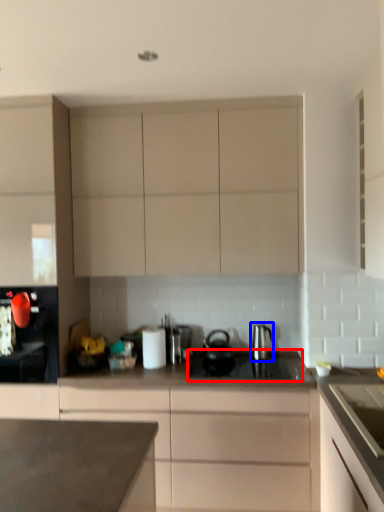
Question: Among these objects, which one is farthest to the camera, gas stove (highlighted by a red box) or kitchen appliance (highlighted by a blue box)?

Choices:
 (A) gas stove
 (B) kitchen appliance

Answer: (B)